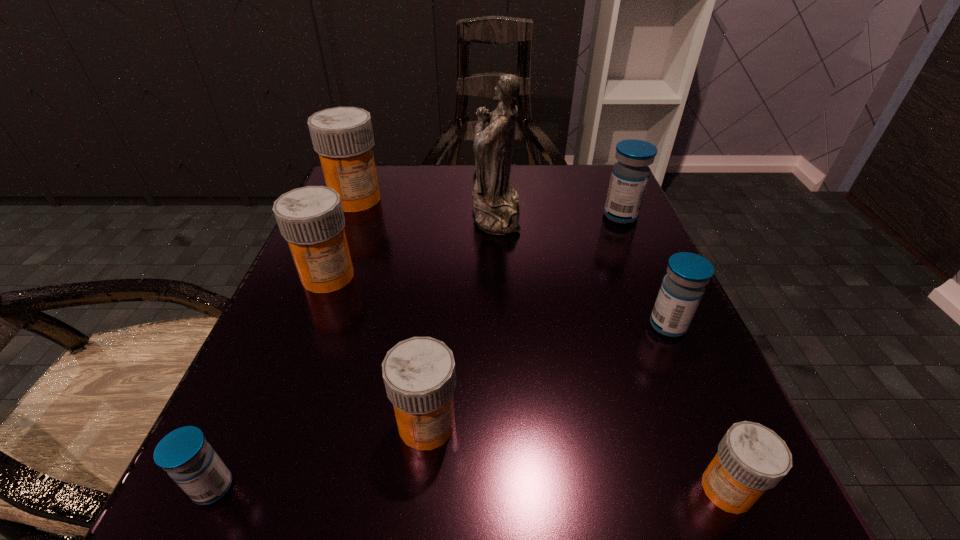
What are the coordinates of `vacant space located 0.260m on the label side of the third farthest medicine` in the screenshot? It's located at [263, 442].

Locate an element on the screen. Image resolution: width=960 pixels, height=540 pixels. free space located on the label side of the third farthest orange medicine is located at coordinates (417, 526).

Identify the location of vacant position located on the left of the second smallest blue medicine. (558, 325).

In order to click on vacant position located on the label side of the smallest orange medicine in this screenshot , I will do `click(657, 489)`.

The height and width of the screenshot is (540, 960). Find the location of `free space located on the label side of the smallest orange medicine`. free space located on the label side of the smallest orange medicine is located at coordinates (549, 489).

At what (x,y) coordinates should I click in order to perform the action: click on vacant space located on the label side of the smallest orange medicine. Please return your answer as a coordinate pair (x, y). Looking at the image, I should click on (362, 489).

Where is `free spot located 0.100m on the back of the leftmost blue medicine`? This screenshot has width=960, height=540. free spot located 0.100m on the back of the leftmost blue medicine is located at coordinates (255, 394).

This screenshot has height=540, width=960. I want to click on figurine that is at the far edge, so click(x=496, y=207).

Image resolution: width=960 pixels, height=540 pixels. What are the coordinates of `object that is positioned at the far left corner` in the screenshot? It's located at (343, 137).

Identify the location of object situated at the near left corner. Image resolution: width=960 pixels, height=540 pixels. (184, 453).